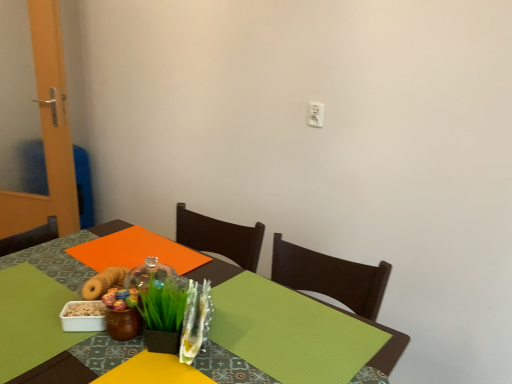
Question: Does green leafy grass at center have a lesser height compared to green fabric table at center?

Choices:
 (A) yes
 (B) no

Answer: (A)

Question: Does green leafy grass at center have a greater height compared to green fabric table at center?

Choices:
 (A) no
 (B) yes

Answer: (A)

Question: Is green leafy grass at center further to camera compared to green fabric table at center?

Choices:
 (A) yes
 (B) no

Answer: (A)

Question: Are green leafy grass at center and green fabric table at center located far from each other?

Choices:
 (A) no
 (B) yes

Answer: (A)

Question: Is green leafy grass at center to the right of green fabric table at center from the viewer's perspective?

Choices:
 (A) no
 (B) yes

Answer: (B)

Question: Does green leafy grass at center have a smaller size compared to green fabric table at center?

Choices:
 (A) no
 (B) yes

Answer: (B)

Question: Is green fabric table at center far from green leafy grass at center?

Choices:
 (A) no
 (B) yes

Answer: (A)

Question: Can you confirm if green fabric table at center is thinner than green leafy grass at center?

Choices:
 (A) yes
 (B) no

Answer: (B)

Question: Considering the relative positions of green fabric table at center and green leafy grass at center in the image provided, is green fabric table at center to the right of green leafy grass at center from the viewer's perspective?

Choices:
 (A) no
 (B) yes

Answer: (A)

Question: Considering the relative sizes of green fabric table at center and green leafy grass at center in the image provided, is green fabric table at center shorter than green leafy grass at center?

Choices:
 (A) yes
 (B) no

Answer: (B)

Question: Is green fabric table at center next to green leafy grass at center?

Choices:
 (A) no
 (B) yes

Answer: (A)

Question: Is green fabric table at center taller than green leafy grass at center?

Choices:
 (A) no
 (B) yes

Answer: (B)

Question: Does white plastic electric outlet at upper center come in front of green leafy grass at center?

Choices:
 (A) no
 (B) yes

Answer: (A)